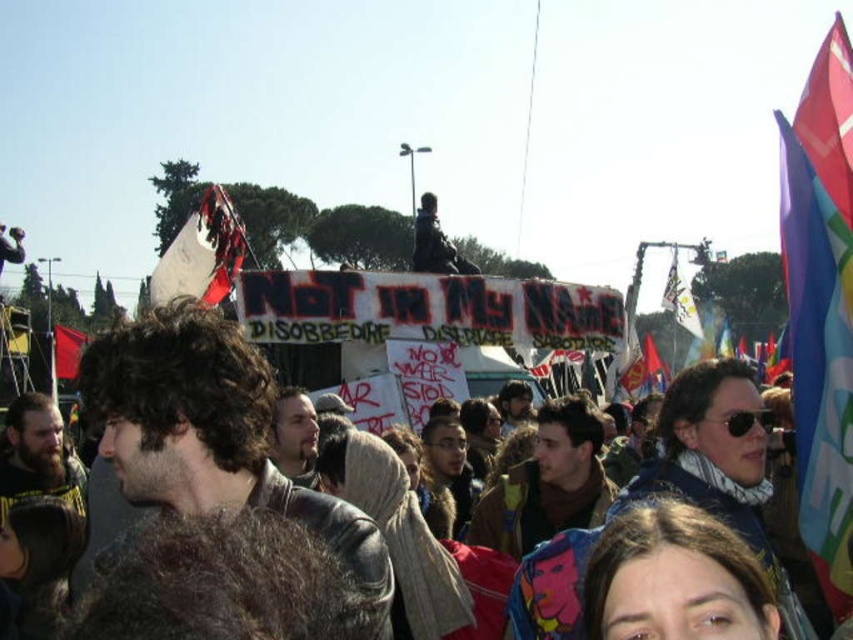
Question: Which object is positioned closest to the rusty metal sign at upper left?

Choices:
 (A) polyester flag at right
 (B) dark brown hair at center

Answer: (B)

Question: Does polyester flag at right come behind red fabric flag at right?

Choices:
 (A) yes
 (B) no

Answer: (B)

Question: Is brown hair at lower center closer to the viewer compared to rusty metal sign at upper left?

Choices:
 (A) no
 (B) yes

Answer: (B)

Question: Which object is the closest to the red fabric flag at left?

Choices:
 (A) rusty metal sign at upper left
 (B) dark brown hair at center

Answer: (A)

Question: Based on their relative distances, which object is nearer to the red fabric flag at right?

Choices:
 (A) polyester flag at right
 (B) rusty metal sign at upper left
 (C) red fabric flag at left
 (D) dark brown hair at center

Answer: (A)

Question: Can you confirm if red fabric flag at left is positioned to the left of red fabric flag at right?

Choices:
 (A) yes
 (B) no

Answer: (A)